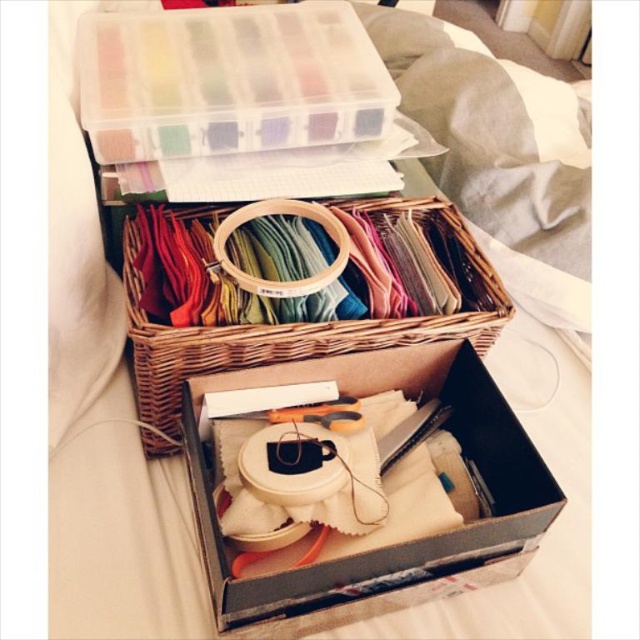
You are trying to stack the white cardboard box at center and the woven wood basket at center on top of each other. Which one should you place at the bottom to ensure stability?

You should place the white cardboard box at center at the bottom because it has a lesser height compared to the woven wood basket at center, providing a wider base for stability.

You are organizing your crafting supplies and have a storage shelf with limited depth. You need to place both the white cardboard box at center and the woven wood basket at center on the shelf. Which item should you place first to ensure both fit on the shelf?

The white cardboard box at center is thinner than the woven wood basket at center, so you should place the white cardboard box at center first to allow space for the thicker basket.